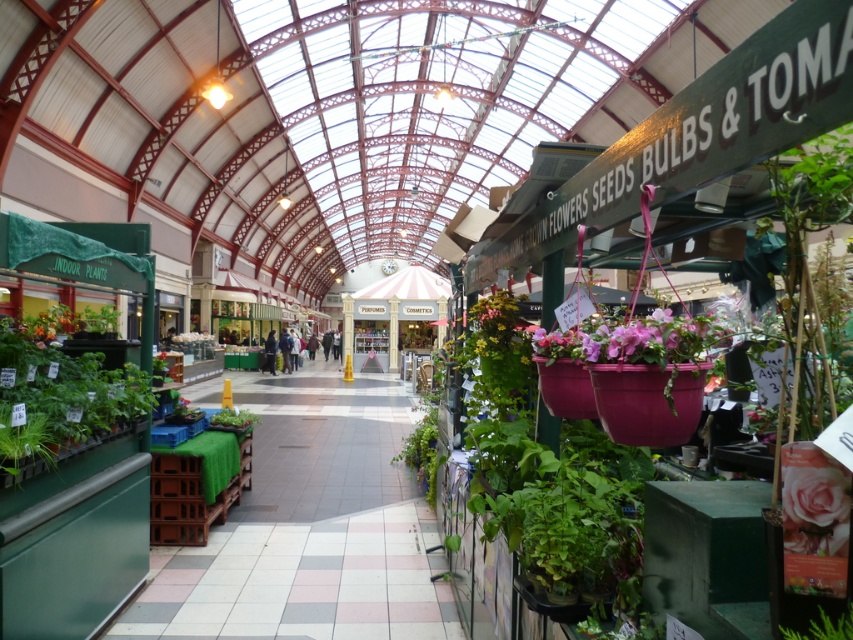
Between pink matte flower pot at center and pink matte rose at lower right, which one appears on the left side from the viewer's perspective?

pink matte flower pot at center

Who is lower down, pink matte flower pot at center or pink matte rose at lower right?

Positioned lower is pink matte rose at lower right.

Locate an element on the screen. Image resolution: width=853 pixels, height=640 pixels. pink matte flower pot at center is located at coordinates (633, 339).

Identify the location of pink matte flower pot at center. Image resolution: width=853 pixels, height=640 pixels. (633, 339).